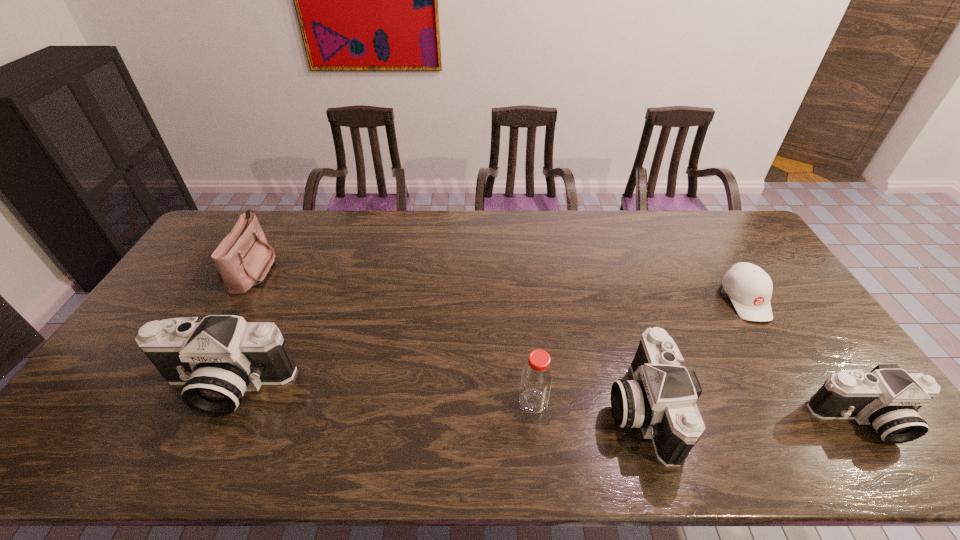
This screenshot has height=540, width=960. I want to click on vacant space located on the front pocket of the shoulder bag, so click(389, 269).

Identify the location of vacant area located 0.050m on the front-facing side of the shortest object. (768, 337).

At what (x,y) coordinates should I click in order to perform the action: click on free space located 0.270m on the left of the bottle. Please return your answer as a coordinate pair (x, y). Looking at the image, I should click on (412, 402).

You are a GUI agent. You are given a task and a screenshot of the screen. Output one action in this format:
    pyautogui.click(x=<x>, y=<y>)
    Task: Click on the object positioned at the far edge
    The image size is (960, 540).
    Given the screenshot: What is the action you would take?
    pyautogui.click(x=243, y=259)

I want to click on bottle at the near edge, so click(536, 379).

Where is `camera at the left edge`? camera at the left edge is located at coordinates (216, 360).

You are a GUI agent. You are given a task and a screenshot of the screen. Output one action in this format:
    pyautogui.click(x=<x>, y=<y>)
    Task: Click on the shoulder bag located in the left edge section of the desktop
    Image resolution: width=960 pixels, height=540 pixels.
    Given the screenshot: What is the action you would take?
    pyautogui.click(x=243, y=259)

Locate an element on the screen. Image resolution: width=960 pixels, height=540 pixels. camera present at the right edge is located at coordinates (888, 398).

Find the location of a particular element. baseball cap present at the right edge is located at coordinates (749, 287).

The image size is (960, 540). In order to click on object that is at the far left corner in this screenshot , I will do `click(243, 259)`.